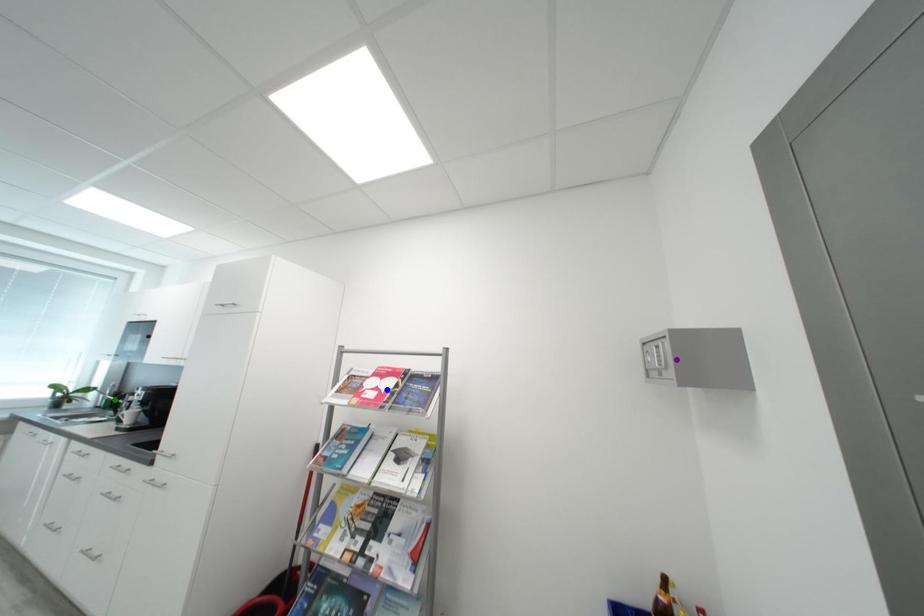
Order these from farthest to nearest:
green point
blue point
purple point

green point < blue point < purple point